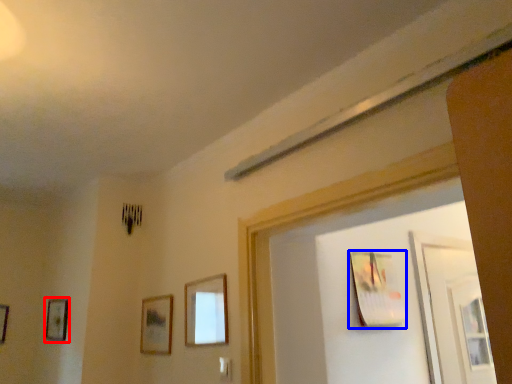
Question: Which point is closer to the camera, picture frame (highlighted by a red box) or picture frame (highlighted by a blue box)?

Choices:
 (A) picture frame
 (B) picture frame

Answer: (B)